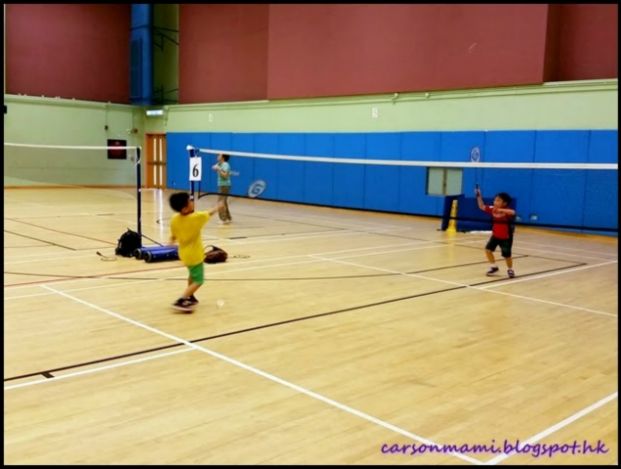
Where is `light green painted walls`? light green painted walls is located at coordinates (474, 108), (53, 119).